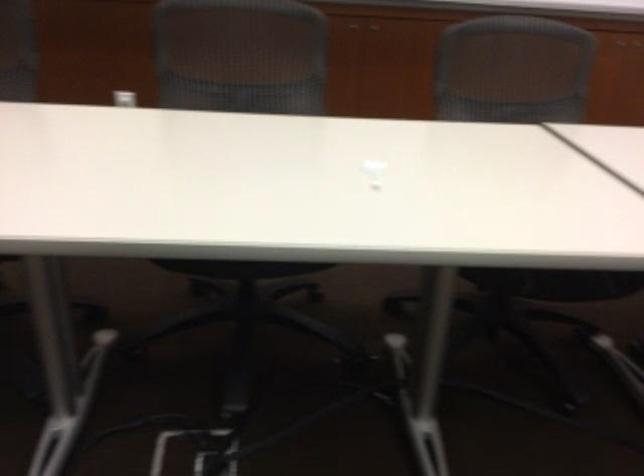
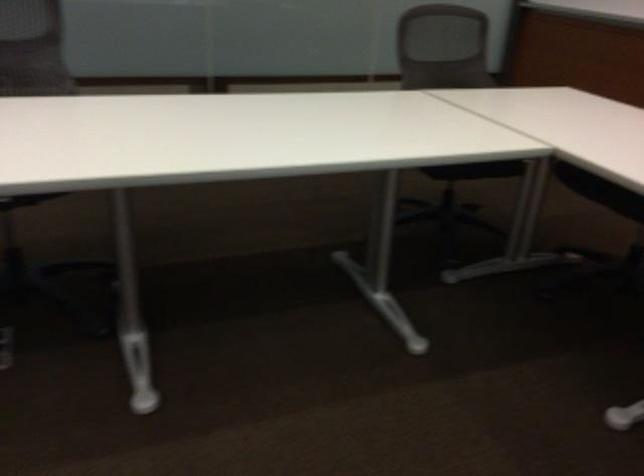
Question: The camera is either moving clockwise (left) or counter-clockwise (right) around the object. The first image is from the beginning of the video and the second image is from the end. Is the camera moving left or right when shooting the video?

Choices:
 (A) Left
 (B) Right

Answer: (B)